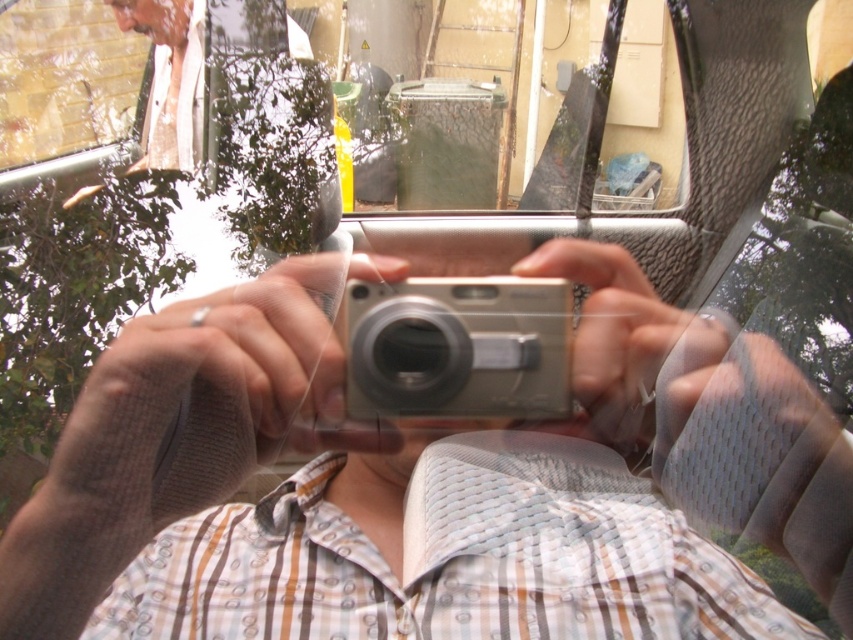
You are standing in front of the glass surface and want to take a photo of the outdoor scene. However, there are two points marked on the glass at coordinates point [316,524] and point [439,307]. Which point is closer to you when looking through the glass?

Point [439,307] is closer to you because point [316,524] is behind it.

You are a photographer trying to frame a shot with both the white textured shirt at center and the silver metallic camera at center in the same photo. Given that your camera has a minimum focus distance of 5 inches, will you be able to capture both objects clearly in the photo?

The white textured shirt at center and silver metallic camera at center are 5.53 inches apart from each other. Since the minimum focus distance is 5 inches, the 5.53 inch separation is sufficient to ensure both objects are in focus and clearly captured in the photo.